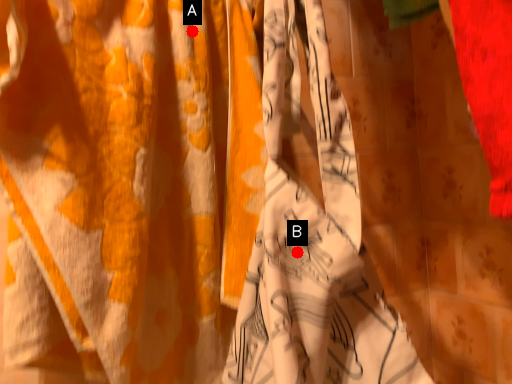
Question: Two points are circled on the image, labeled by A and B beside each circle. Among these points, which one is nearest to the camera?

Choices:
 (A) A is closer
 (B) B is closer

Answer: (B)